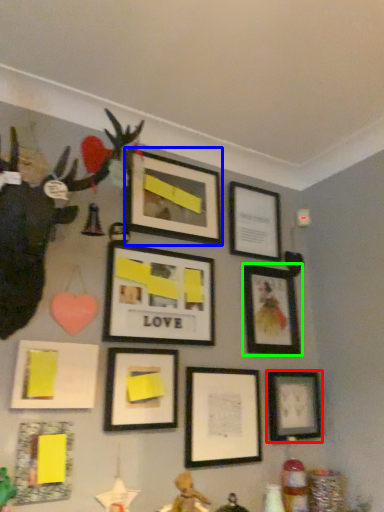
Question: Estimate the real-world distances between objects in this image. Which object is farther from picture frame (highlighted by a red box), picture frame (highlighted by a blue box) or picture frame (highlighted by a green box)?

Choices:
 (A) picture frame
 (B) picture frame

Answer: (A)